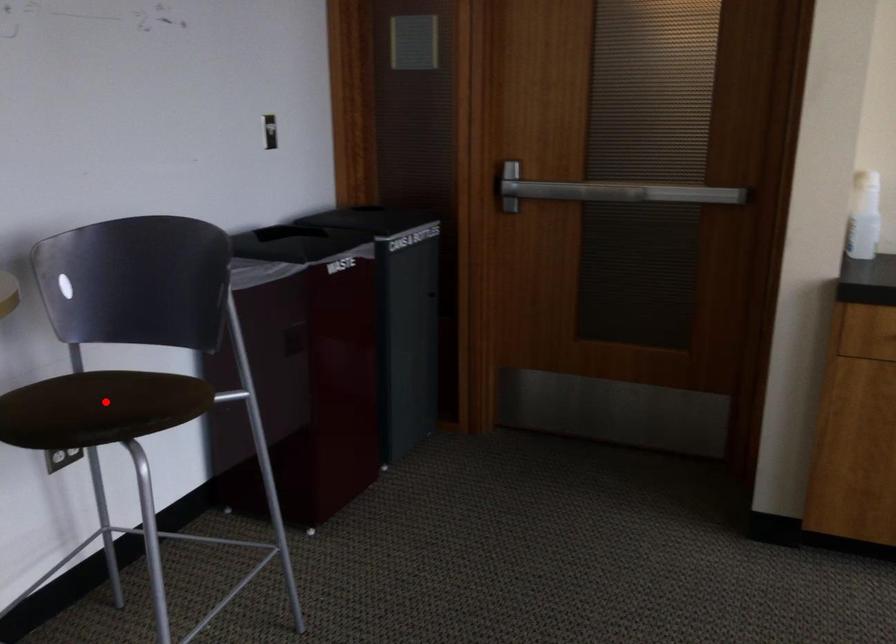
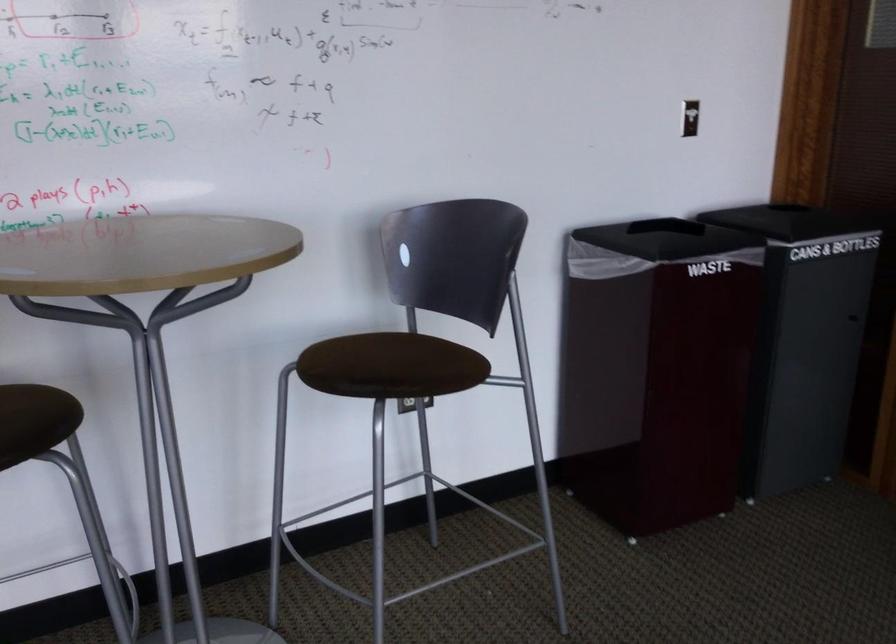
Locate, in the second image, the point that corresponds to the highlighted location in the first image.

(391, 366)